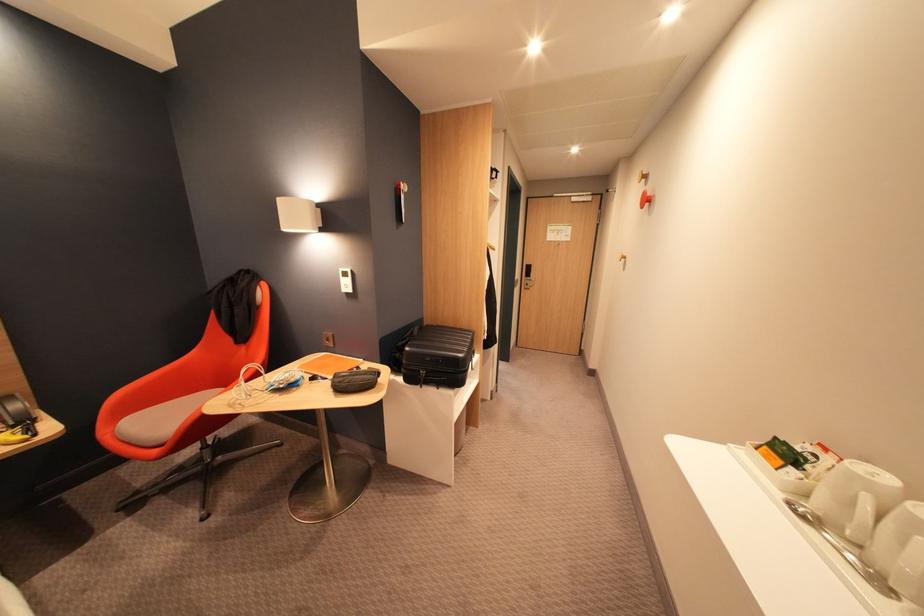
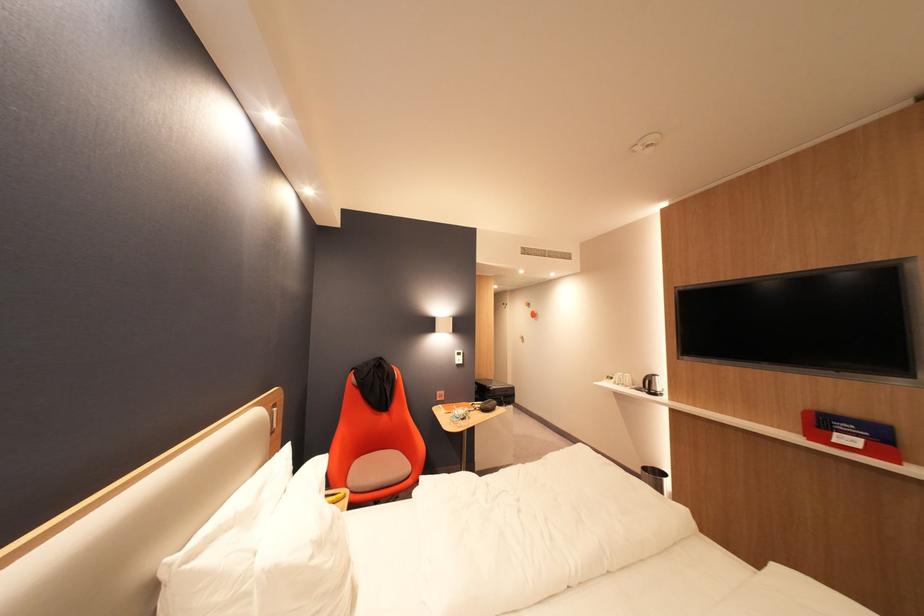
In the second image, find the point that corresponds to the point at 417,350 in the first image.

(502, 390)